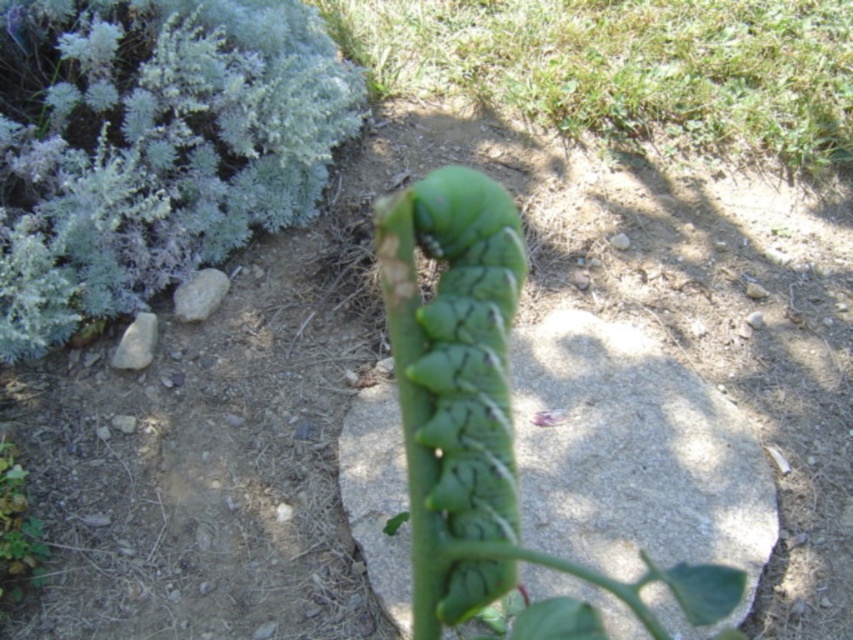
You are a gardener who wants to place a small decorative statue between the green rough stone at center and the green matte plant at lower left. Based on their positions, which object should the statue be closer to if you want it to appear closer to the front of the scene?

The green rough stone at center is closer to the viewer than the green matte plant at lower left. Therefore, placing the statue closer to the green rough stone at center will make it appear nearer to the front of the scene.